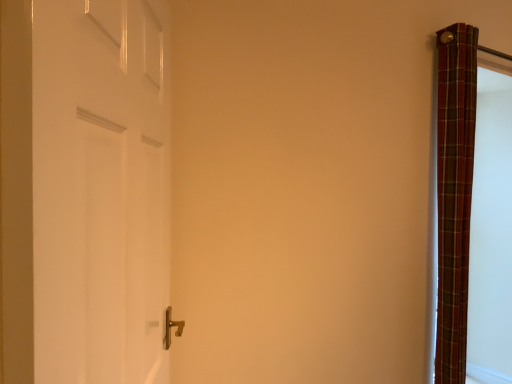
In order to face white glossy door at left, should I rotate leftwards or rightwards?

Rotate left and turn 15.700 degrees.

Measure the distance between point (x=97, y=196) and camera.

A distance of 25.51 inches exists between point (x=97, y=196) and camera.

Locate an element on the screen. Image resolution: width=512 pixels, height=384 pixels. white glossy door at left is located at coordinates (101, 190).

The width and height of the screenshot is (512, 384). What do you see at coordinates (101, 190) in the screenshot? I see `white glossy door at left` at bounding box center [101, 190].

Measure the distance between point (461,154) and camera.

6.67 feet.

This screenshot has width=512, height=384. Identify the location of plaid fabric curtain at right. (454, 193).

This screenshot has height=384, width=512. Describe the element at coordinates (454, 193) in the screenshot. I see `plaid fabric curtain at right` at that location.

Locate an element on the screen. The width and height of the screenshot is (512, 384). white glossy door at left is located at coordinates (101, 190).

In the scene shown: Considering the positions of objects plaid fabric curtain at right and white glossy door at left in the image provided, who is more to the left, plaid fabric curtain at right or white glossy door at left?

white glossy door at left.

Is the position of plaid fabric curtain at right less distant than that of white glossy door at left?

No, plaid fabric curtain at right is behind white glossy door at left.

Is point (442, 142) farther from camera compared to point (106, 144)?

That is True.

From the image's perspective, does plaid fabric curtain at right appear higher than white glossy door at left?

Incorrect, from the image's perspective, plaid fabric curtain at right is lower than white glossy door at left.

From a real-world perspective, who is located higher, plaid fabric curtain at right or white glossy door at left?

white glossy door at left is physically above.

Which object is wider, plaid fabric curtain at right or white glossy door at left?

Wider between the two is plaid fabric curtain at right.

Considering the relative sizes of plaid fabric curtain at right and white glossy door at left in the image provided, is plaid fabric curtain at right taller than white glossy door at left?

Yes.

Which of these two, plaid fabric curtain at right or white glossy door at left, is bigger?

Bigger between the two is white glossy door at left.

From the picture: Is plaid fabric curtain at right inside or outside of white glossy door at left?

plaid fabric curtain at right exists outside the volume of white glossy door at left.

Is plaid fabric curtain at right in contact with white glossy door at left?

No, plaid fabric curtain at right is not next to white glossy door at left.

Is plaid fabric curtain at right oriented away from white glossy door at left?

No, plaid fabric curtain at right's orientation is not away from white glossy door at left.

How much distance is there between plaid fabric curtain at right and white glossy door at left?

The distance of plaid fabric curtain at right from white glossy door at left is 5.56 feet.

In the image, there is a white glossy door at left. At what (x,y) coordinates should I click in order to perform the action: click on curtain below it (from the image's perspective). Please return your answer as a coordinate pair (x, y). Looking at the image, I should click on (454, 193).

Between white glossy door at left and plaid fabric curtain at right, which one appears on the left side from the viewer's perspective?

From the viewer's perspective, white glossy door at left appears more on the left side.

Is the position of white glossy door at left less distant than that of plaid fabric curtain at right?

Yes.

Is point (95, 356) closer or farther from the camera than point (467, 162)?

Point (95, 356) is positioned closer to the camera compared to point (467, 162).

From the image's perspective, is white glossy door at left below plaid fabric curtain at right?

Incorrect, from the image's perspective, white glossy door at left is higher than plaid fabric curtain at right.

From a real-world perspective, is white glossy door at left beneath plaid fabric curtain at right?

No, from a real-world perspective, white glossy door at left is not below plaid fabric curtain at right.

From the picture: Looking at their sizes, would you say white glossy door at left is wider or thinner than plaid fabric curtain at right?

white glossy door at left is thinner than plaid fabric curtain at right.

From the picture: Which of these two, white glossy door at left or plaid fabric curtain at right, stands shorter?

white glossy door at left is shorter.

Who is smaller, white glossy door at left or plaid fabric curtain at right?

With smaller size is plaid fabric curtain at right.

Can plaid fabric curtain at right be found inside white glossy door at left?

No, plaid fabric curtain at right is located outside of white glossy door at left.

Would you consider white glossy door at left to be distant from plaid fabric curtain at right?

Yes.

Does white glossy door at left turn towards plaid fabric curtain at right?

No, white glossy door at left is not oriented towards plaid fabric curtain at right.

Can you tell me how much white glossy door at left and plaid fabric curtain at right differ in facing direction?

58.5 degrees.

This screenshot has width=512, height=384. Identify the location of door above the plaid fabric curtain at right (from the image's perspective). (101, 190).

Find the location of `door in front of the plaid fabric curtain at right`. door in front of the plaid fabric curtain at right is located at coordinates pos(101,190).

Where is `door lying on the left of plaid fabric curtain at right`? This screenshot has height=384, width=512. door lying on the left of plaid fabric curtain at right is located at coordinates (101, 190).